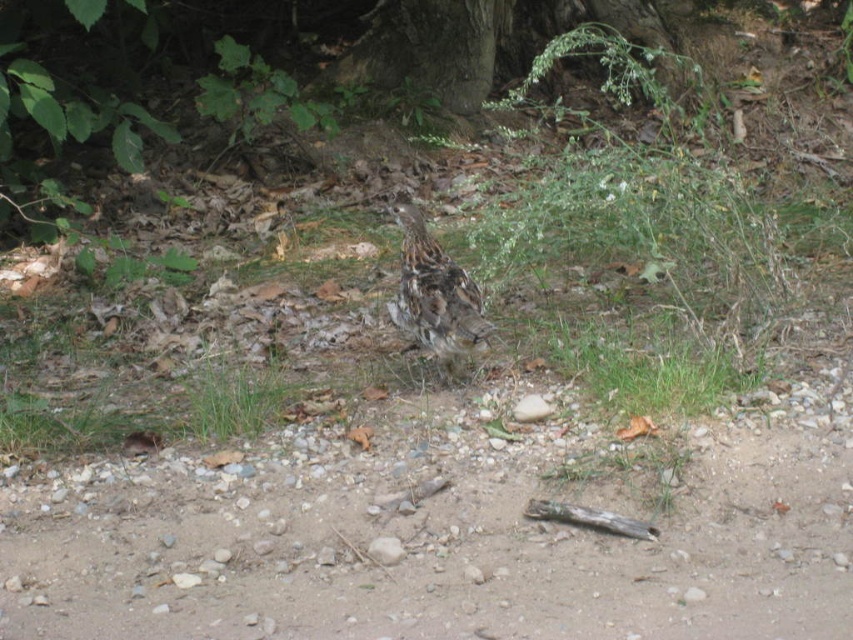
I want to click on smooth bark tree at upper center, so 479,42.

Is the position of smooth bark tree at upper center less distant than that of green soft grass at center?

No, smooth bark tree at upper center is further to the viewer.

The width and height of the screenshot is (853, 640). What do you see at coordinates (479, 42) in the screenshot?
I see `smooth bark tree at upper center` at bounding box center [479, 42].

This screenshot has width=853, height=640. What are the coordinates of `smooth bark tree at upper center` in the screenshot? It's located at (479, 42).

Is brown speckled bird at center above green soft grass at center?

Yes, brown speckled bird at center is above green soft grass at center.

Which is above, brown speckled bird at center or green soft grass at center?

brown speckled bird at center is above.

Who is more distant from viewer, (448, 264) or (241, 384)?

Point (241, 384)

The width and height of the screenshot is (853, 640). Identify the location of brown speckled bird at center. (434, 292).

Between smooth bark tree at upper center and brown speckled bird at center, which one is positioned higher?

smooth bark tree at upper center

Can you confirm if smooth bark tree at upper center is bigger than brown speckled bird at center?

Yes.

Where is `smooth bark tree at upper center`? This screenshot has height=640, width=853. smooth bark tree at upper center is located at coordinates (479, 42).

I want to click on smooth bark tree at upper center, so pos(479,42).